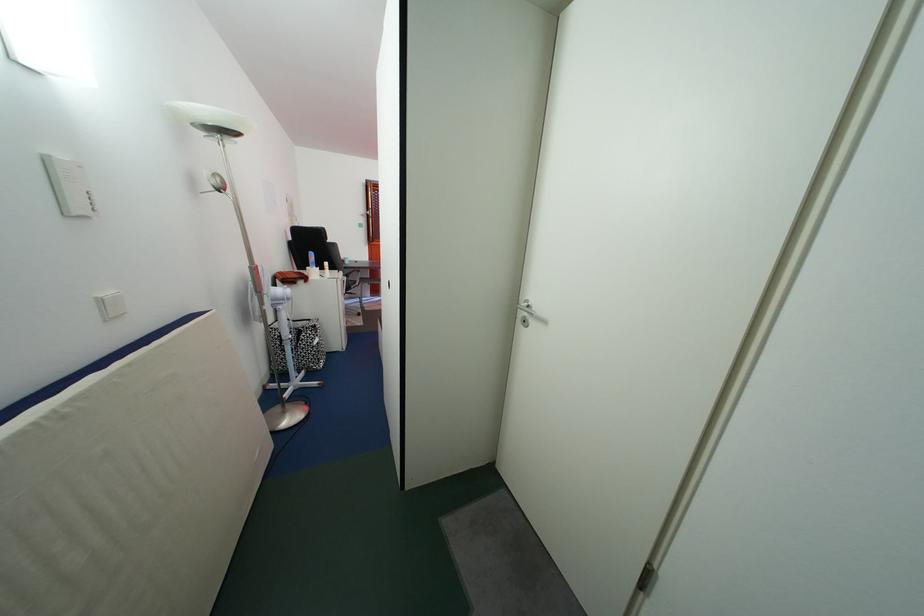
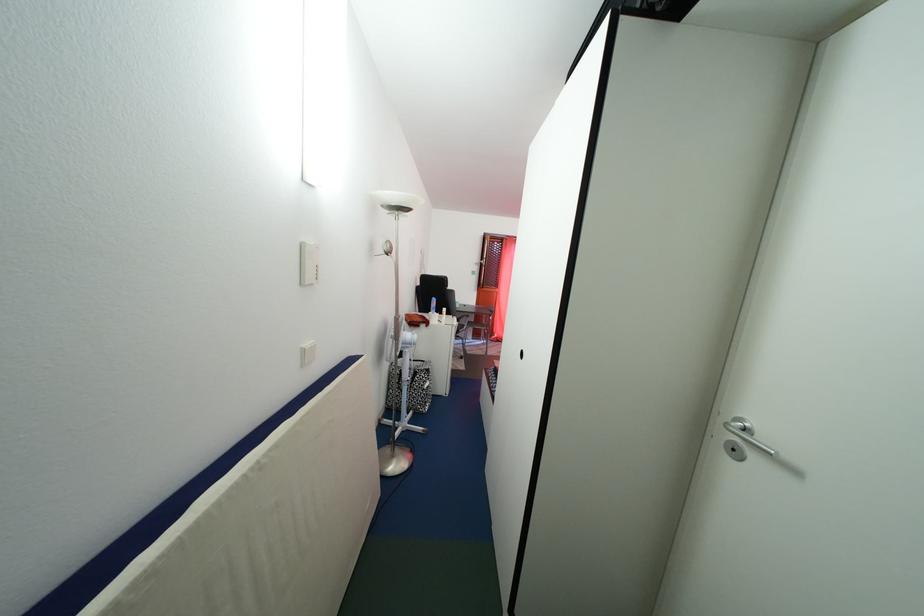
Locate, in the second image, the point that corresponds to the point at 308,339 in the first image.

(423, 381)